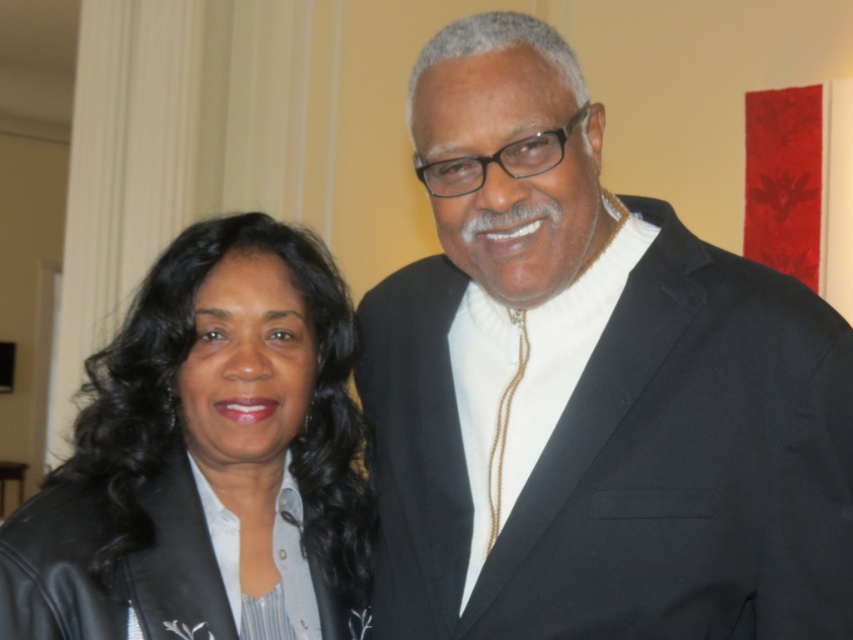
In the scene shown: Does black matte suit at center have a greater width compared to leather jacket at left?

Correct, the width of black matte suit at center exceeds that of leather jacket at left.

Who is lower down, black matte suit at center or leather jacket at left?

leather jacket at left is below.

Which is behind, point (462, 419) or point (252, 355)?

The point (462, 419) is more distant.

What are the coordinates of `black matte suit at center` in the screenshot? It's located at click(x=590, y=388).

What are the coordinates of `leather jacket at left` in the screenshot? It's located at (207, 458).

What are the coordinates of `leather jacket at left` in the screenshot? It's located at (207, 458).

Which of these two, black matte suit at center or black leather jacket at lower left, stands shorter?

black leather jacket at lower left

Does black matte suit at center lie in front of black leather jacket at lower left?

Yes.

Who is more forward, (738,520) or (54,572)?

Positioned in front is point (738,520).

Where is `black matte suit at center`? Image resolution: width=853 pixels, height=640 pixels. black matte suit at center is located at coordinates (590, 388).